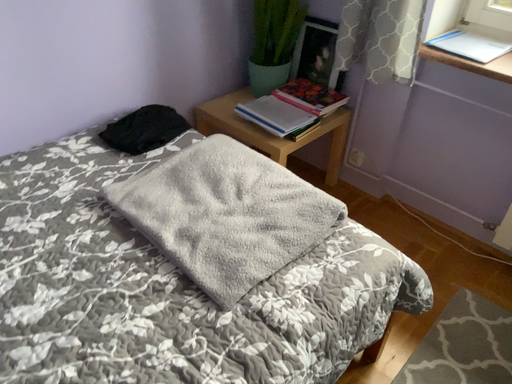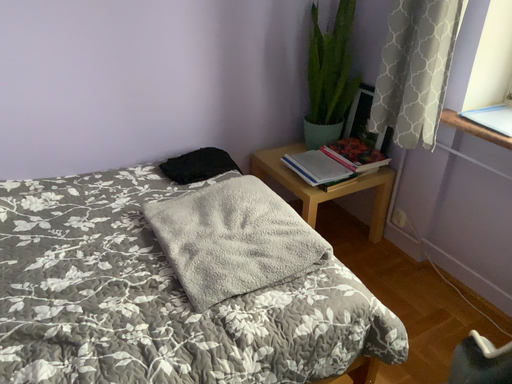
Question: Which way did the camera rotate in the video?

Choices:
 (A) rotated upward
 (B) rotated downward

Answer: (A)